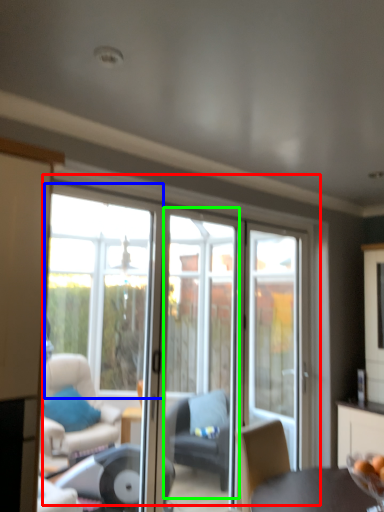
Question: Based on their relative distances, which object is nearer to door (highlighted by a red box)? Choose from window (highlighted by a blue box) and screen door (highlighted by a green box).

Choices:
 (A) window
 (B) screen door

Answer: (B)